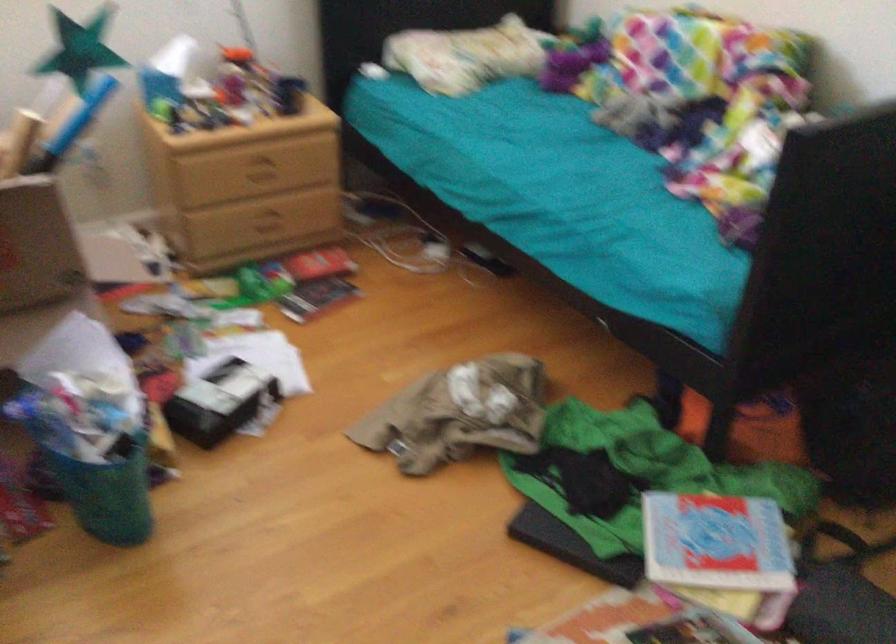
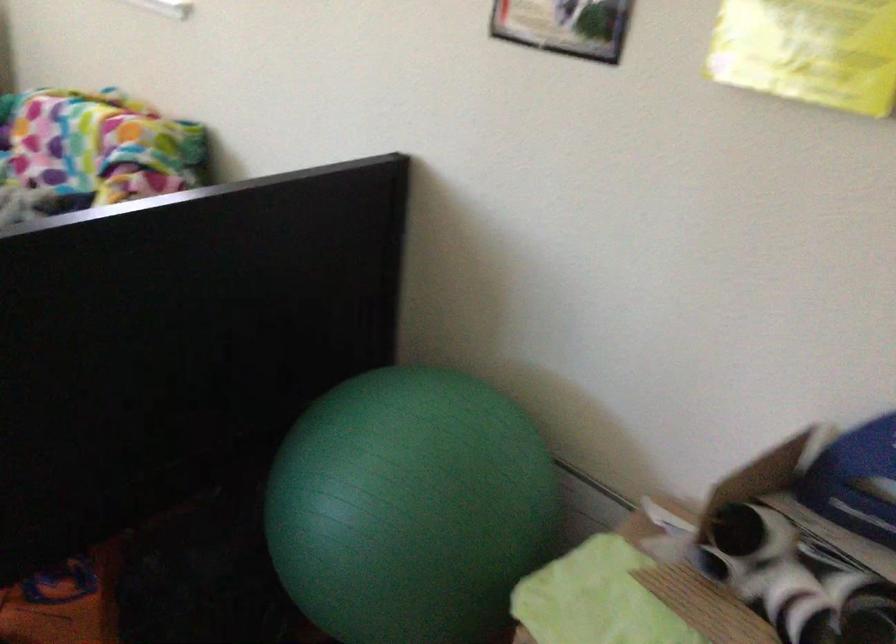
Question: How did the camera likely rotate?

Choices:
 (A) Left
 (B) Right
 (C) Up
 (D) Down

Answer: (B)